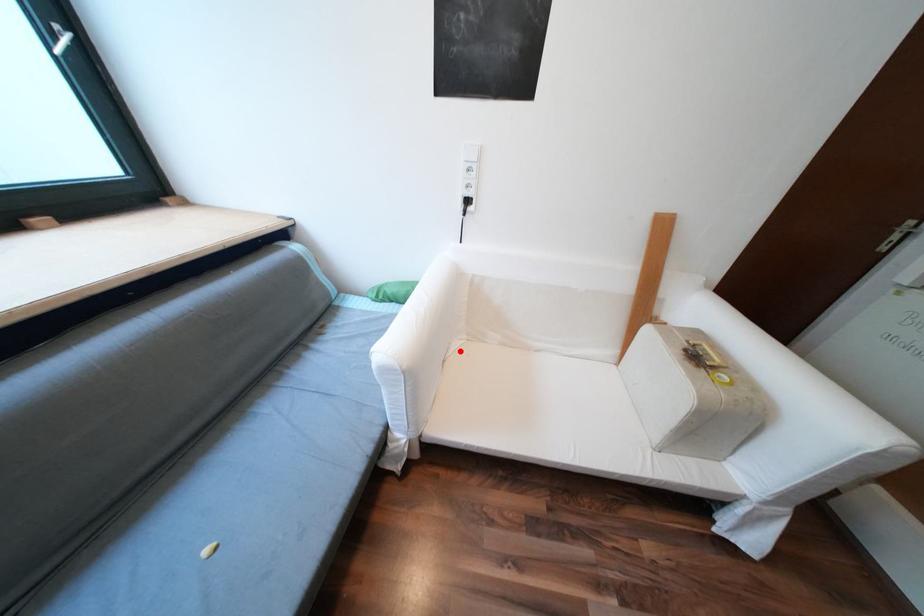
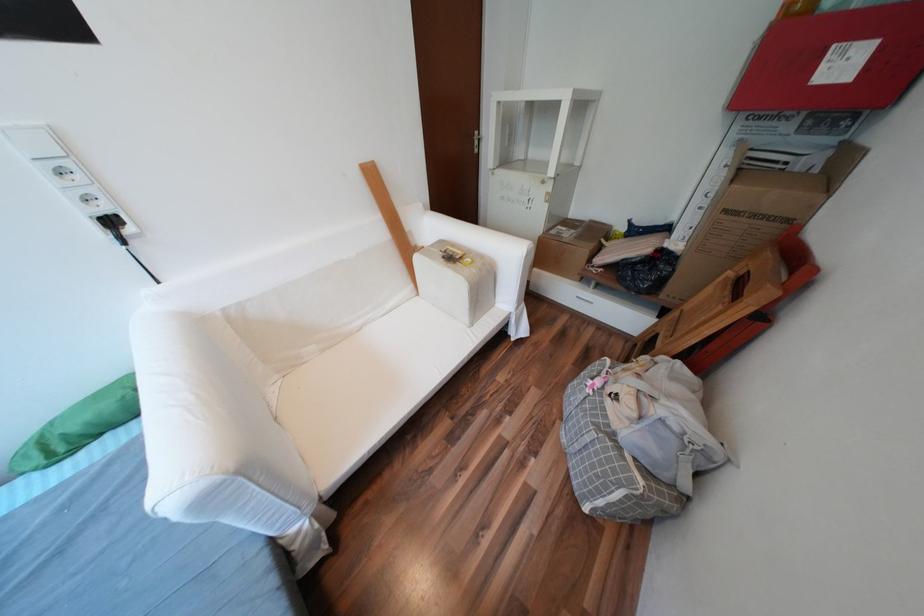
In the second image, find the point that corresponds to the highlighted location in the first image.

(283, 403)